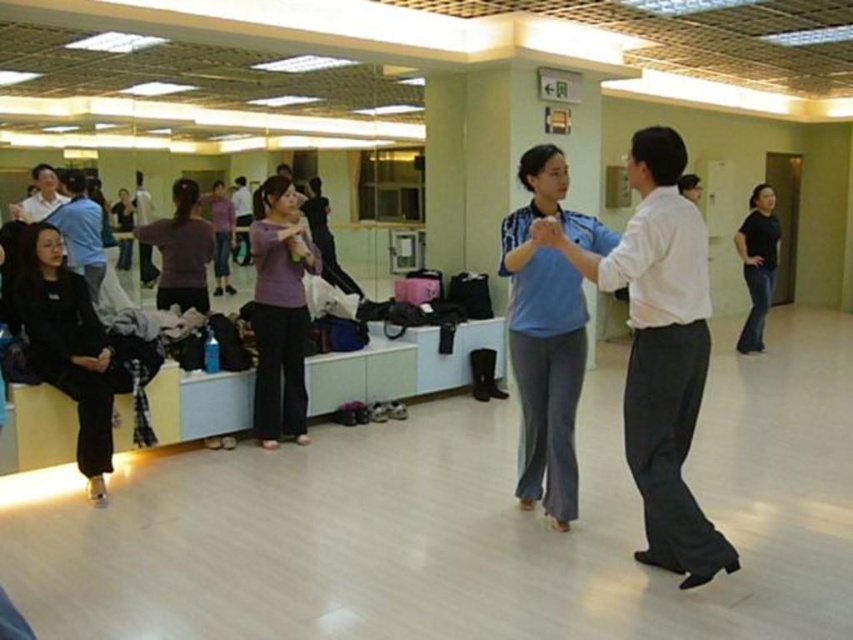
Can you confirm if white smooth shirt at center is taller than black matte pants at lower left?

Indeed, white smooth shirt at center has a greater height compared to black matte pants at lower left.

Is white smooth shirt at center bigger than black matte pants at lower left?

Yes.

The height and width of the screenshot is (640, 853). Find the location of `white smooth shirt at center`. white smooth shirt at center is located at coordinates (660, 349).

The width and height of the screenshot is (853, 640). What are the coordinates of `white smooth shirt at center` in the screenshot? It's located at (660, 349).

Does matte purple sweater at center appear over purple matte sweater at center?

Incorrect, matte purple sweater at center is not positioned above purple matte sweater at center.

Is point (183, 285) more distant than point (238, 228)?

No, it is not.

Which is behind, point (189, 180) or point (244, 253)?

Point (244, 253)

What are the coordinates of `matte purple sweater at center` in the screenshot? It's located at (181, 250).

Which is more to the right, blue cotton shirt at center or matte black shirt at upper left?

From the viewer's perspective, blue cotton shirt at center appears more on the right side.

Is point (517, 474) behind point (51, 188)?

No, (517, 474) is closer to viewer.

Who is more distant from viewer, (526, 336) or (41, 186)?

Point (41, 186)

The width and height of the screenshot is (853, 640). In order to click on blue cotton shirt at center in this screenshot , I will do `click(547, 332)`.